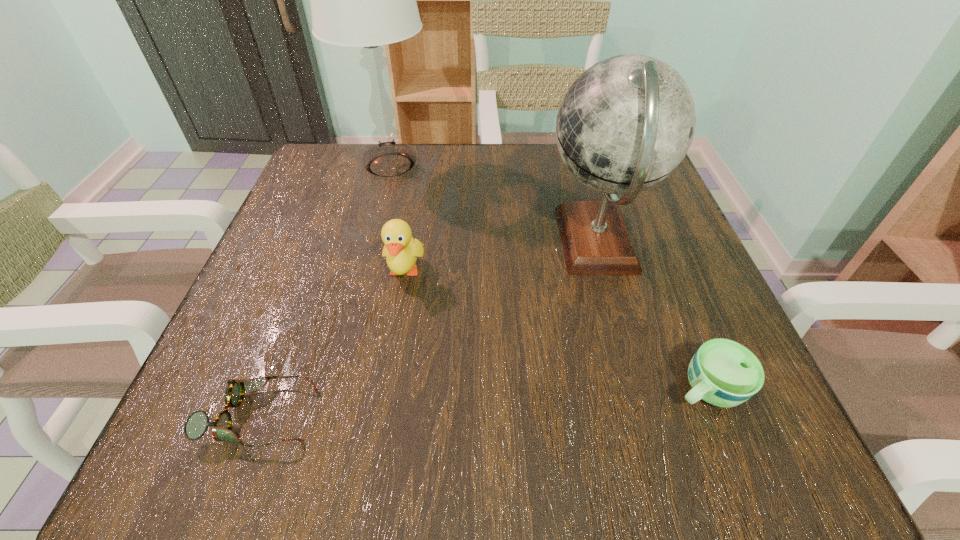
This screenshot has height=540, width=960. I want to click on free space between the second tallest object and the third tallest object, so click(500, 257).

This screenshot has width=960, height=540. I want to click on free space that is in between the duckling and the shortest object, so click(x=331, y=344).

Locate an element on the screen. vacant area between the shortest object and the duckling is located at coordinates 331,344.

Image resolution: width=960 pixels, height=540 pixels. I want to click on blank region between the cup and the globe, so click(x=652, y=315).

Where is `vacant area that lies between the second tallest object and the shortest object`? The width and height of the screenshot is (960, 540). vacant area that lies between the second tallest object and the shortest object is located at coordinates (427, 329).

Identify the location of vacant space that is in between the shortest object and the fourth tallest object. (482, 402).

Image resolution: width=960 pixels, height=540 pixels. Find the location of `free space between the duckling and the second shortest object`. free space between the duckling and the second shortest object is located at coordinates (556, 330).

Where is `empty space between the table lamp and the globe`? The height and width of the screenshot is (540, 960). empty space between the table lamp and the globe is located at coordinates (493, 204).

Choose which object is the nearest neighbor to the second shortest object. Please provide its 2D coordinates. Your answer should be formatted as a tuple, i.e. [(x, y)], where the tuple contains the x and y coordinates of a point satisfying the conditions above.

[(626, 123)]

Choose which object is the third nearest neighbor to the second shortest object. Please provide its 2D coordinates. Your answer should be formatted as a tuple, i.e. [(x, y)], where the tuple contains the x and y coordinates of a point satisfying the conditions above.

[(197, 423)]